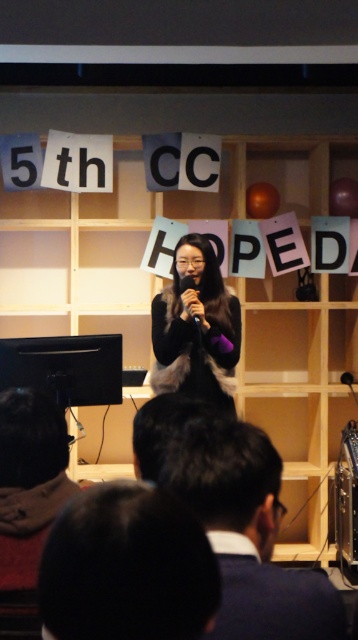
You are an event organizer who needs to ensure the wooden bookshelf at center and the black matte fur coat at center are both visible to the audience. Given their sizes, which object might block the view of the other?

The wooden bookshelf at center has a larger size compared to the black matte fur coat at center, so the bookshelf could potentially block the view of the coat if positioned between the coat and the audience.

You are attending an event and notice two items at the center of the scene. One is the dark hair at center and the other is the black matte fur coat at center. Which item is positioned lower in relation to the other?

The dark hair at center is located below black matte fur coat at center, so the dark hair at center is positioned lower than the black matte fur coat at center.